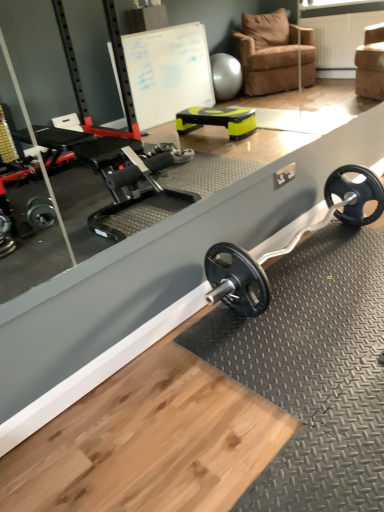
Where is `vacant space in front of polished silver barbell at center`? This screenshot has height=512, width=384. vacant space in front of polished silver barbell at center is located at coordinates (301, 360).